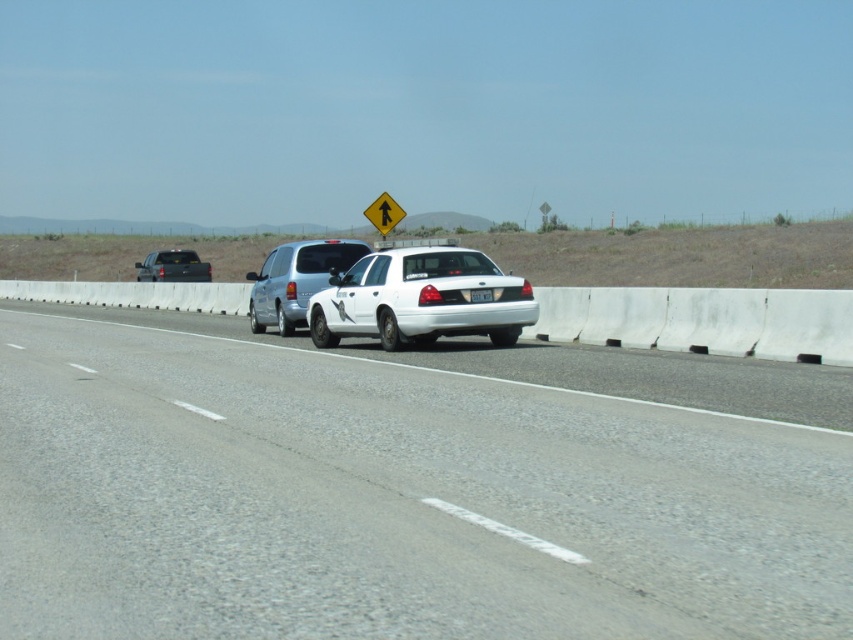
Does white glossy sedan at center have a lesser height compared to silver metallic minivan at center?

Yes.

Find the location of a particular element. white glossy sedan at center is located at coordinates (421, 298).

Where is `white glossy sedan at center`? The width and height of the screenshot is (853, 640). white glossy sedan at center is located at coordinates (421, 298).

Does white glossy sedan at center come in front of yellow reflective plastic sign at center?

Yes, it is in front of yellow reflective plastic sign at center.

Does white glossy sedan at center have a smaller size compared to yellow reflective plastic sign at center?

Yes.

Where is `white glossy sedan at center`? This screenshot has width=853, height=640. white glossy sedan at center is located at coordinates (421, 298).

Looking at this image, who is shorter, white glossy sedan at center or white plastic license plate at center?

white plastic license plate at center

Which is in front, point (312, 310) or point (490, 300)?

Point (490, 300)

Between point (485, 284) and point (474, 300), which one is positioned in front?

Point (474, 300) is in front.

Where is `white glossy sedan at center`? This screenshot has width=853, height=640. white glossy sedan at center is located at coordinates (421, 298).